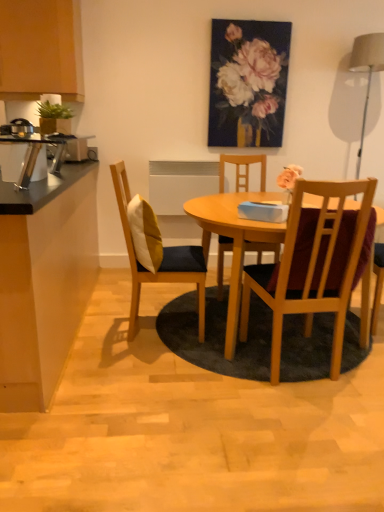
Identify the location of free space underneath wooden chair with cushion at center, the 3th chair from the right (from a real-world perspective). The image size is (384, 512). (152, 324).